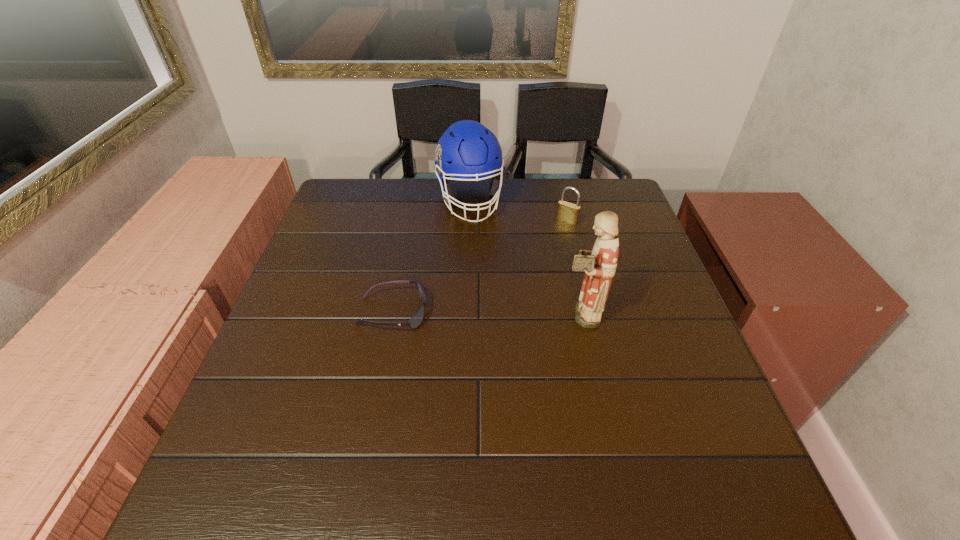
The width and height of the screenshot is (960, 540). In order to click on free space on the desktop that is between the sunglasses and the figurine and is positioned on the front-facing side of the padlock in this screenshot , I will do `click(491, 313)`.

Identify the location of vacant space on the desktop that is between the sunglasses and the figurine and is positioned on the front-facing side of the football helmet. (505, 314).